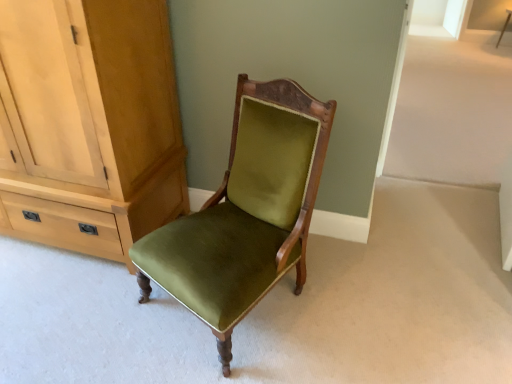
What do you see at coordinates (245, 212) in the screenshot?
I see `velvet green chair at center` at bounding box center [245, 212].

The height and width of the screenshot is (384, 512). What do you see at coordinates (88, 124) in the screenshot?
I see `matte wood cabinet at left` at bounding box center [88, 124].

At what (x,y) coordinates should I click in order to perform the action: click on wooden side table at upper right. Please return your answer as a coordinate pair (x, y). Image resolution: width=512 pixels, height=384 pixels. Looking at the image, I should click on point(504,26).

Can you confirm if velvet green chair at center is bigger than matte wood cabinet at left?

Incorrect, velvet green chair at center is not larger than matte wood cabinet at left.

Does point (222, 224) lie in front of point (60, 211)?

That is True.

I want to click on chair on the right of matte wood cabinet at left, so click(x=245, y=212).

From a real-world perspective, is velvet green chair at center located higher than matte wood cabinet at left?

No, from a real-world perspective, velvet green chair at center is not over matte wood cabinet at left

Can you confirm if matte wood cabinet at left is taller than wooden side table at upper right?

Indeed, matte wood cabinet at left has a greater height compared to wooden side table at upper right.

Considering the relative positions of matte wood cabinet at left and wooden side table at upper right in the image provided, is matte wood cabinet at left to the left or to the right of wooden side table at upper right?

Clearly, matte wood cabinet at left is on the left of wooden side table at upper right in the image.

Locate an element on the screen. The image size is (512, 384). cabinetry on the left of wooden side table at upper right is located at coordinates (88, 124).

How many degrees apart are the facing directions of matte wood cabinet at left and wooden side table at upper right?

0.435 degrees.

Which is behind, matte wood cabinet at left or velvet green chair at center?

matte wood cabinet at left is further from the camera.

Which of these two, matte wood cabinet at left or velvet green chair at center, is wider?

With larger width is velvet green chair at center.

Do you think matte wood cabinet at left is within velvet green chair at center, or outside of it?

matte wood cabinet at left exists outside the volume of velvet green chair at center.

Visually, is velvet green chair at center positioned to the left or to the right of wooden side table at upper right?

velvet green chair at center is to the left of wooden side table at upper right.

Between velvet green chair at center and wooden side table at upper right, which one has more height?

velvet green chair at center is taller.

How distant is velvet green chair at center from wooden side table at upper right?

velvet green chair at center is 19.36 feet from wooden side table at upper right.

How many degrees apart are the facing directions of velvet green chair at center and wooden side table at upper right?

velvet green chair at center and wooden side table at upper right are facing 25.3 degrees away from each other.

Based on the photo, which object is further away from the camera, wooden side table at upper right or matte wood cabinet at left?

wooden side table at upper right is more distant.

Is wooden side table at upper right wider than matte wood cabinet at left?

Incorrect, the width of wooden side table at upper right does not surpass that of matte wood cabinet at left.

Is wooden side table at upper right directly adjacent to velvet green chair at center?

They are not placed beside each other.

Would you say wooden side table at upper right is outside velvet green chair at center?

That's correct, wooden side table at upper right is outside of velvet green chair at center.

Does wooden side table at upper right have a smaller size compared to velvet green chair at center?

Yes.

Can you tell me how much wooden side table at upper right and velvet green chair at center differ in facing direction?

The facing directions of wooden side table at upper right and velvet green chair at center are 25.3 degrees apart.

In the image, there is a matte wood cabinet at left. At what (x,y) coordinates should I click in order to perform the action: click on chair below it (from a real-world perspective). Please return your answer as a coordinate pair (x, y). The image size is (512, 384). Looking at the image, I should click on (245, 212).

Identify the location of cabinetry that appears on the left of wooden side table at upper right. Image resolution: width=512 pixels, height=384 pixels. (88, 124).

Which object lies further to the anchor point wooden side table at upper right, matte wood cabinet at left or velvet green chair at center?

matte wood cabinet at left is further to wooden side table at upper right.

Looking at the image, which one is located further to velvet green chair at center, wooden side table at upper right or matte wood cabinet at left?

Among the two, wooden side table at upper right is located further to velvet green chair at center.

Looking at the image, which one is located closer to velvet green chair at center, matte wood cabinet at left or wooden side table at upper right?

matte wood cabinet at left is positioned closer to the anchor velvet green chair at center.

Looking at the image, which one is located further to wooden side table at upper right, velvet green chair at center or matte wood cabinet at left?

matte wood cabinet at left is positioned further to the anchor wooden side table at upper right.

Considering their positions, is wooden side table at upper right positioned closer to matte wood cabinet at left than velvet green chair at center?

velvet green chair at center is closer to matte wood cabinet at left.

Based on their spatial positions, is velvet green chair at center or wooden side table at upper right closer to matte wood cabinet at left?

The object closer to matte wood cabinet at left is velvet green chair at center.

You are a GUI agent. You are given a task and a screenshot of the screen. Output one action in this format:
    pyautogui.click(x=<x>, y=<y>)
    Task: Click on the chair between matte wood cabinet at left and wooden side table at upper right in the horizontal direction
    
    Given the screenshot: What is the action you would take?
    pyautogui.click(x=245, y=212)